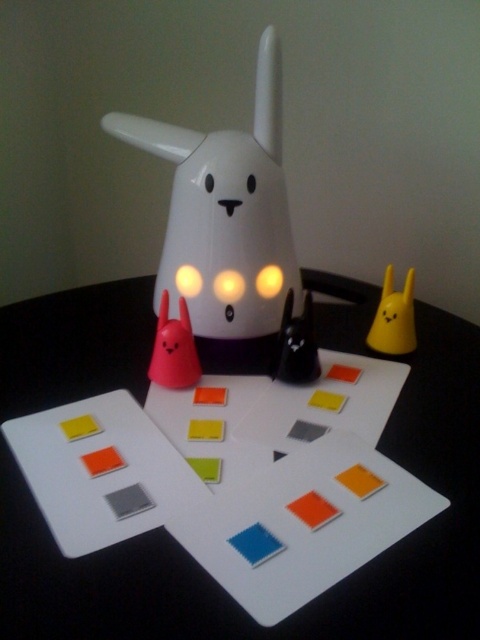
You are setting up a display and need to place both the white plastic table at center and the yellow matte rabbit at upper right on a shelf. The shelf has a width of 1.2 meters. Can both items fit side by side without overlapping?

The white plastic table at center is wider than the yellow matte rabbit at upper right. Since the shelf is 1.2 meters wide, it depends on the combined width of both items. However, the description only states the table is wider, not the exact dimensions. Without specific measurements, we cannot confirm if they will fit without overlapping.

You are arranging a childrens party and see the white plastic table at center and the matte pink cone at center. Which object is positioned to the right of the other?

The white plastic table at center is to the right of the matte pink cone at center.